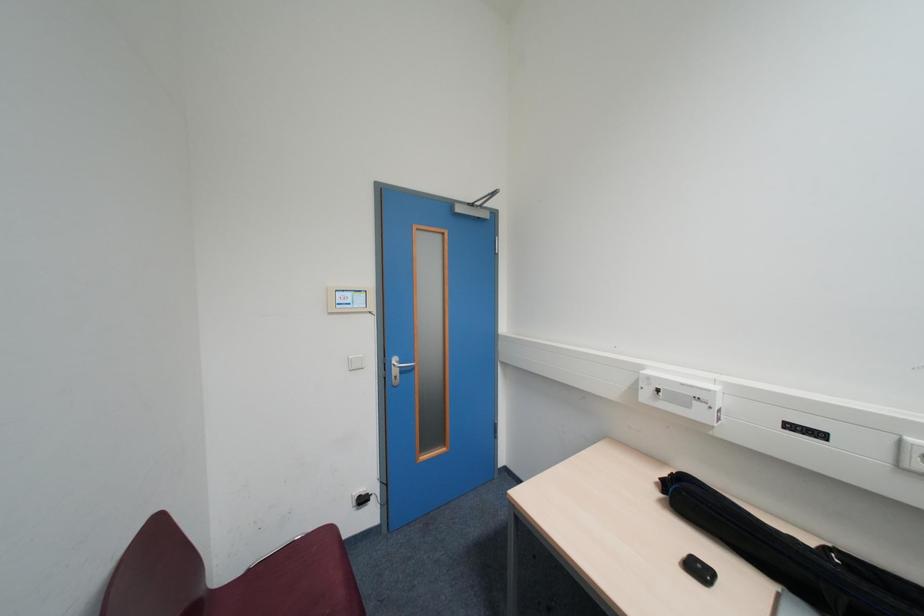
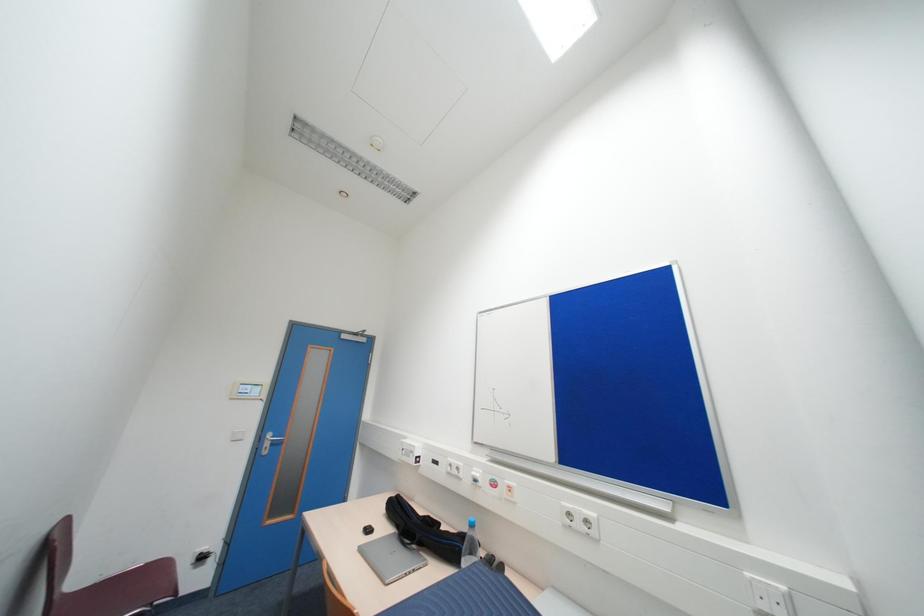
Which direction would the cameraman need to move to produce the second image?

The movement direction of the cameraman is right, backward.